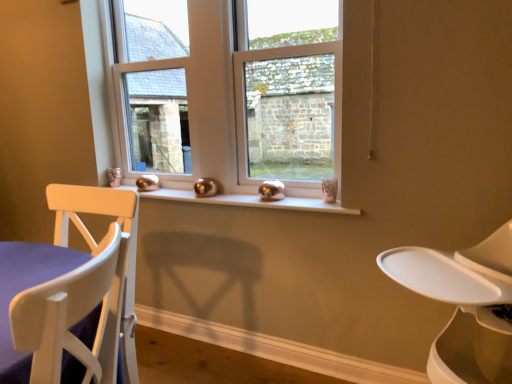
Question: From a real-world perspective, is white plastic feeding chair at right above or below clear glass window at center?

Choices:
 (A) below
 (B) above

Answer: (A)

Question: Looking at their shapes, would you say white plastic feeding chair at right is wider or thinner than clear glass window at center?

Choices:
 (A) wide
 (B) thin

Answer: (A)

Question: Based on their relative distances, which object is nearer to the clear glass window at center?

Choices:
 (A) clear glass window at center
 (B) white plastic feeding chair at right
 (C) white glossy window sill at center
 (D) white wood chair at left

Answer: (A)

Question: Which object is positioned farthest from the clear glass window at center?

Choices:
 (A) clear glass window at center
 (B) white glossy window sill at center
 (C) white wood chair at left
 (D) white plastic feeding chair at right

Answer: (D)